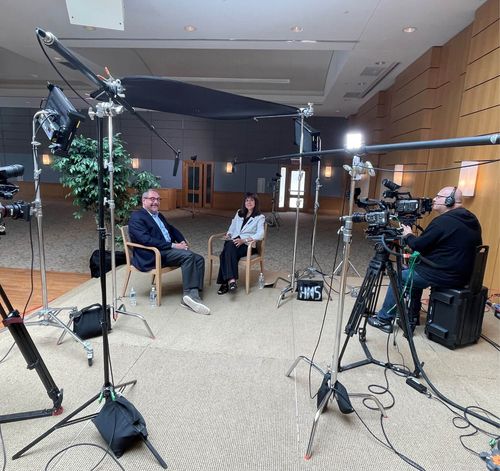
You are a GUI agent. You are given a task and a screenshot of the screen. Output one action in this format:
    pyautogui.click(x=<x>, y=<y>)
    Task: Click on the hardwood floor area
    Image resolution: width=500 pixels, height=471 pixels.
    Given the screenshot: What is the action you would take?
    pyautogui.click(x=15, y=285)